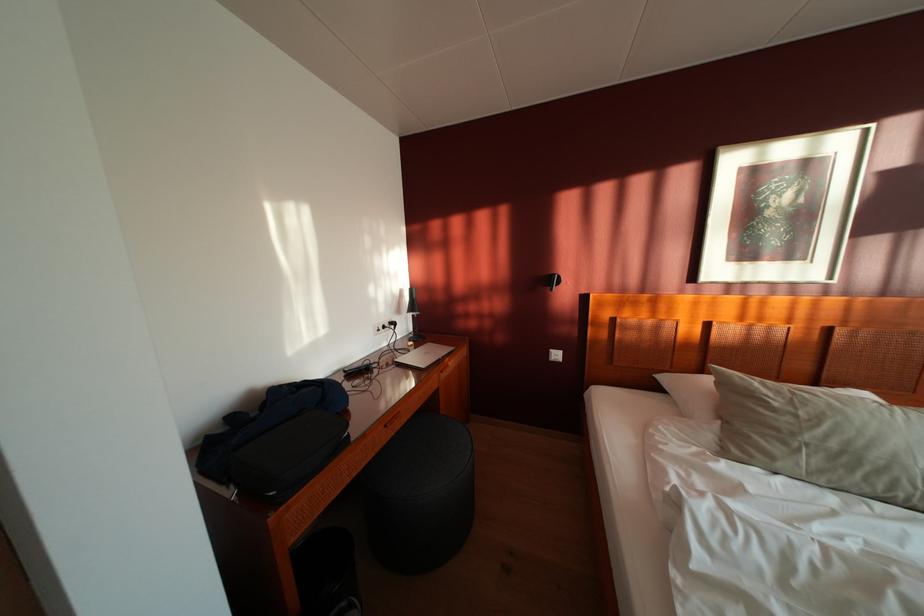
Where is `black stool`? This screenshot has width=924, height=616. black stool is located at coordinates (419, 493).